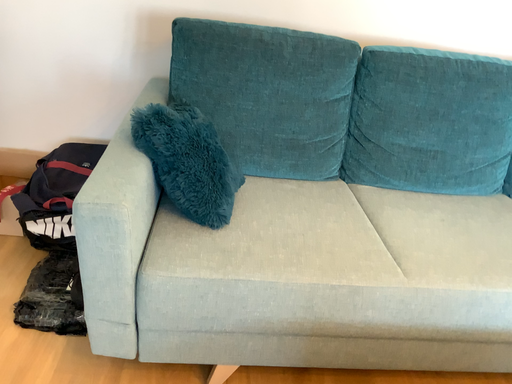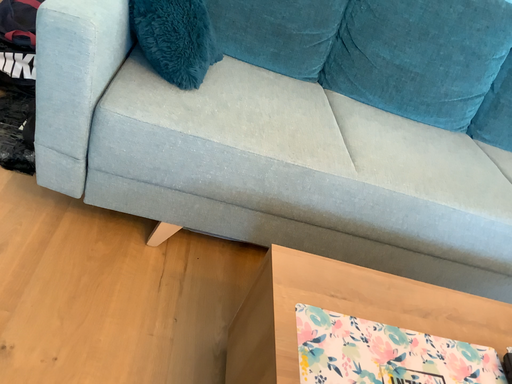
Question: How did the camera likely rotate when shooting the video?

Choices:
 (A) rotated upward
 (B) rotated downward

Answer: (B)